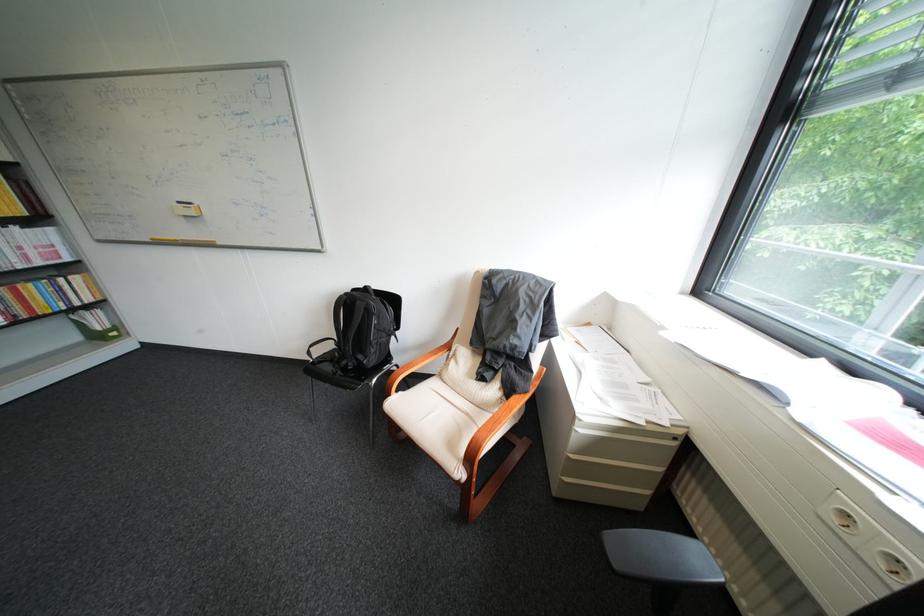
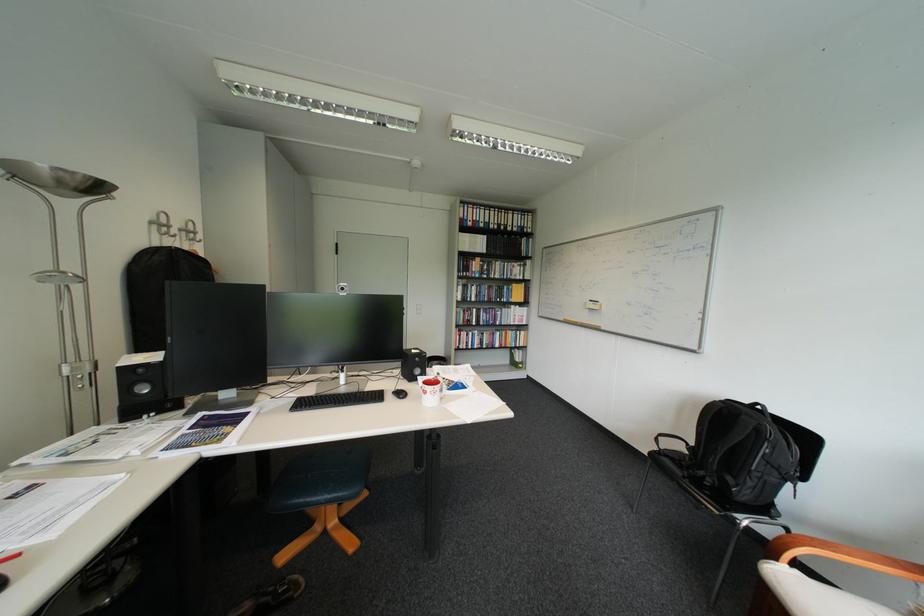
The point at (370, 302) is marked in the first image. Where is the corresponding point in the second image?

(756, 418)